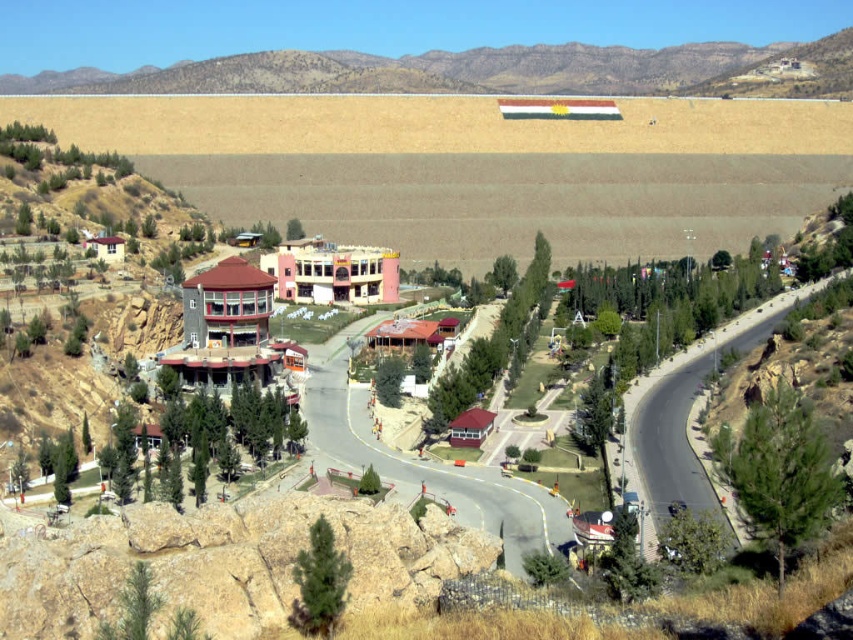
Question: Which point appears farthest from the camera in this image?

Choices:
 (A) (653, 484)
 (B) (515, 72)

Answer: (B)

Question: Among these objects, which one is farthest from the camera?

Choices:
 (A) brown rocky mountain at upper center
 (B) asphalt road at right

Answer: (A)

Question: Is brown rocky mountain at upper center closer to camera compared to asphalt road at right?

Choices:
 (A) yes
 (B) no

Answer: (B)

Question: Is brown rocky mountain at upper center further to the viewer compared to asphalt road at right?

Choices:
 (A) yes
 (B) no

Answer: (A)

Question: Does brown rocky mountain at upper center appear on the right side of asphalt road at right?

Choices:
 (A) yes
 (B) no

Answer: (B)